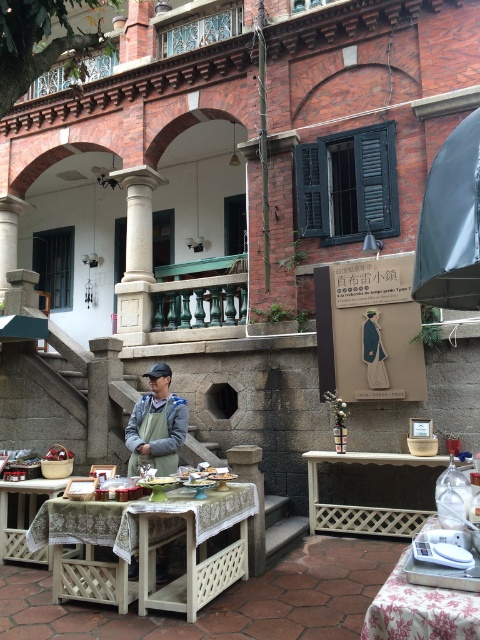
Question: Which point is closer to the camera?

Choices:
 (A) wooden lattice table at center
 (B) gray fabric apron at center
 (C) white lattice table at center
 (D) white lattice picnic table at center

Answer: (D)

Question: Does white lattice picnic table at center appear on the right side of white lattice table at center?

Choices:
 (A) no
 (B) yes

Answer: (A)

Question: Does white lattice picnic table at center have a lesser width compared to floral fabric table at lower right?

Choices:
 (A) yes
 (B) no

Answer: (B)

Question: Does white lattice picnic table at center appear on the right side of gray fabric apron at center?

Choices:
 (A) yes
 (B) no

Answer: (A)

Question: Which of the following is the closest to the observer?

Choices:
 (A) (144, 438)
 (B) (468, 579)
 (C) (325, 504)
 (D) (60, 522)

Answer: (B)

Question: Which object appears farthest from the camera in this image?

Choices:
 (A) white lattice picnic table at center
 (B) white lattice table at center

Answer: (B)